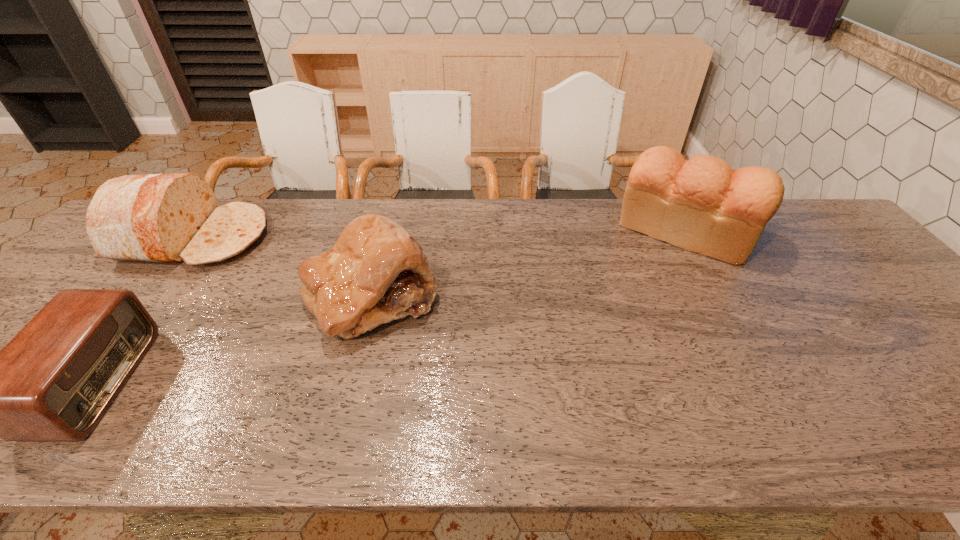
This screenshot has width=960, height=540. I want to click on vacant space that is in between the rightmost object and the leftmost bread, so click(x=441, y=234).

At what (x,y) coordinates should I click in order to perform the action: click on vacant space in between the second object from right to left and the leftmost bread. Please return your answer as a coordinate pair (x, y). Looking at the image, I should click on (284, 267).

Where is `free space between the leftmost bread and the second bread from left to right`? Image resolution: width=960 pixels, height=540 pixels. free space between the leftmost bread and the second bread from left to right is located at coordinates (284, 267).

Identify the location of the closest object to the rightmost object. (376, 272).

In order to click on the second closest object to the radio receiver in this screenshot , I will do `click(376, 272)`.

Identify which bread is located as the nearest to the second object from right to left. Please provide its 2D coordinates. Your answer should be formatted as a tuple, i.e. [(x, y)], where the tuple contains the x and y coordinates of a point satisfying the conditions above.

[(167, 218)]

The image size is (960, 540). I want to click on bread that stands as the second closest to the rightmost bread, so click(167, 218).